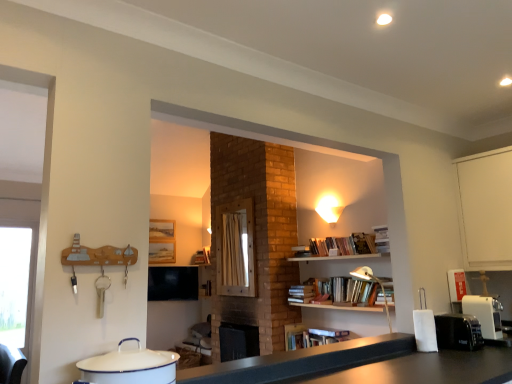
At what (x,y) coordinates should I click in order to perform the action: click on empty space that is ontop of white plastic coffee machine at lower right (from a real-world perspective). Please return your answer as a coordinate pair (x, y). This screenshot has height=384, width=512. Looking at the image, I should click on (480, 301).